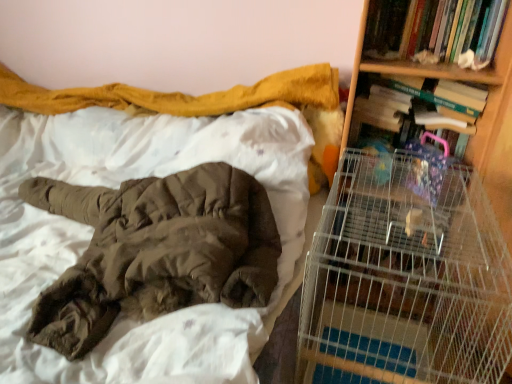
The width and height of the screenshot is (512, 384). Find the location of `hardcover book at upper right, which is the second book in bottom-to-top order`. hardcover book at upper right, which is the second book in bottom-to-top order is located at coordinates tap(433, 28).

How much space does hardcover book at upper right, positioned as the 1th book in bottom-to-top order, occupy vertically?

It is 13.71 inches.

Where is `wooden bookshelf at right`? The image size is (512, 384). wooden bookshelf at right is located at coordinates (442, 77).

In terms of height, does wooden bookshelf at right look taller or shorter compared to hardcover book at upper right, which is the second book in bottom-to-top order?

Clearly, wooden bookshelf at right is taller compared to hardcover book at upper right, which is the second book in bottom-to-top order.

Can you confirm if wooden bookshelf at right is thinner than hardcover book at upper right, which is the second book in bottom-to-top order?

In fact, wooden bookshelf at right might be wider than hardcover book at upper right, which is the second book in bottom-to-top order.

Find the location of `bookshelf on the left of hardcover book at upper right, which is the second book in bottom-to-top order`. bookshelf on the left of hardcover book at upper right, which is the second book in bottom-to-top order is located at coordinates (442, 77).

Which is more to the right, wooden bookshelf at right or hardcover book at upper right, which is the first book in top-to-bottom order?

Positioned to the right is hardcover book at upper right, which is the first book in top-to-bottom order.

Is brown fuzzy blanket at upper left positioned far away from wooden bookshelf at right?

No, there isn't a large distance between brown fuzzy blanket at upper left and wooden bookshelf at right.

Is wooden bookshelf at right at the back of brown fuzzy blanket at upper left?

A: No, brown fuzzy blanket at upper left is not facing the opposite direction of wooden bookshelf at right.

Is brown fuzzy blanket at upper left smaller than wooden bookshelf at right?

Incorrect, brown fuzzy blanket at upper left is not smaller in size than wooden bookshelf at right.

Measure the distance between wooden bookshelf at right and hardcover book at upper right, the 2th book from the top.

They are 4.76 inches apart.

Between point (495, 81) and point (394, 115), which one is positioned in front?

The point (495, 81) is closer to the camera.

Is wooden bookshelf at right bigger than hardcover book at upper right, the 2th book from the top?

Indeed, wooden bookshelf at right has a larger size compared to hardcover book at upper right, the 2th book from the top.

Can you confirm if wooden bookshelf at right is taller than hardcover book at upper right, the 2th book from the top?

Yes.

Is hardcover book at upper right, the 2th book from the top, smaller than wooden bookshelf at right?

Yes, hardcover book at upper right, the 2th book from the top, is smaller than wooden bookshelf at right.

Is point (375, 113) positioned behind point (346, 114)?

No, it is not.

Would you say hardcover book at upper right, positioned as the 1th book in bottom-to-top order, is inside or outside wooden bookshelf at right?

hardcover book at upper right, positioned as the 1th book in bottom-to-top order, is inside wooden bookshelf at right.

From the image's perspective, which is above, hardcover book at upper right, positioned as the 1th book in bottom-to-top order, or wooden bookshelf at right?

wooden bookshelf at right.

Is brown fuzzy blanket at upper left facing away from hardcover book at upper right, which is the second book in bottom-to-top order?

No.

Would you say brown fuzzy blanket at upper left is inside or outside hardcover book at upper right, which is the second book in bottom-to-top order?

brown fuzzy blanket at upper left exists outside the volume of hardcover book at upper right, which is the second book in bottom-to-top order.

From the picture: Who is bigger, brown fuzzy blanket at upper left or hardcover book at upper right, which is the second book in bottom-to-top order?

Bigger between the two is brown fuzzy blanket at upper left.

Is hardcover book at upper right, positioned as the 1th book in bottom-to-top order, aimed at metal wire cage at right?

Yes, hardcover book at upper right, positioned as the 1th book in bottom-to-top order, is oriented towards metal wire cage at right.

Does hardcover book at upper right, the 2th book from the top, appear on the left side of metal wire cage at right?

No.

Looking at this image, considering the relative sizes of hardcover book at upper right, positioned as the 1th book in bottom-to-top order, and metal wire cage at right in the image provided, is hardcover book at upper right, positioned as the 1th book in bottom-to-top order, wider than metal wire cage at right?

No, hardcover book at upper right, positioned as the 1th book in bottom-to-top order, is not wider than metal wire cage at right.

In the scene shown: Does hardcover book at upper right, the 2th book from the top, come behind metal wire cage at right?

Yes.

Who is bigger, wooden bookshelf at right or brown fuzzy blanket at upper left?

Bigger between the two is brown fuzzy blanket at upper left.

Is wooden bookshelf at right to the right of brown fuzzy blanket at upper left from the viewer's perspective?

Yes.

From a real-world perspective, is wooden bookshelf at right physically below brown fuzzy blanket at upper left?

Actually, wooden bookshelf at right is physically above brown fuzzy blanket at upper left in the real world.

Considering the sizes of wooden bookshelf at right and brown fuzzy blanket at upper left in the image, is wooden bookshelf at right wider or thinner than brown fuzzy blanket at upper left?

Clearly, wooden bookshelf at right has less width compared to brown fuzzy blanket at upper left.

What are the coordinates of `bookshelf located on the left of hardcover book at upper right, which is the second book in bottom-to-top order` in the screenshot? It's located at (442, 77).

Where is `bookshelf located above the brown fuzzy blanket at upper left (from the image's perspective)`? The image size is (512, 384). bookshelf located above the brown fuzzy blanket at upper left (from the image's perspective) is located at coordinates (442, 77).

When comparing their distances from brown fuzzy blanket at upper left, does metal wire cage at right or hardcover book at upper right, positioned as the 1th book in bottom-to-top order, seem closer?

metal wire cage at right is positioned closer to the anchor brown fuzzy blanket at upper left.

Looking at the image, which one is located further to hardcover book at upper right, the 2th book from the top, brown fuzzy blanket at upper left or hardcover book at upper right, which is the first book in top-to-bottom order?

brown fuzzy blanket at upper left is further to hardcover book at upper right, the 2th book from the top.

Based on their spatial positions, is hardcover book at upper right, positioned as the 1th book in bottom-to-top order, or hardcover book at upper right, which is the second book in bottom-to-top order, closer to wooden bookshelf at right?

hardcover book at upper right, which is the second book in bottom-to-top order, lies closer to wooden bookshelf at right than the other object.

Considering their positions, is metal wire cage at right positioned closer to hardcover book at upper right, the 2th book from the top, than hardcover book at upper right, which is the second book in bottom-to-top order?

The object closer to hardcover book at upper right, the 2th book from the top, is hardcover book at upper right, which is the second book in bottom-to-top order.

From the image, which object appears to be nearer to hardcover book at upper right, which is the second book in bottom-to-top order, wooden bookshelf at right or hardcover book at upper right, the 2th book from the top?

wooden bookshelf at right.

When comparing their distances from brown fuzzy blanket at upper left, does hardcover book at upper right, the 2th book from the top, or metal wire cage at right seem closer?

metal wire cage at right is positioned closer to the anchor brown fuzzy blanket at upper left.

Considering their positions, is brown fuzzy blanket at upper left positioned further to hardcover book at upper right, which is the second book in bottom-to-top order, than metal wire cage at right?

brown fuzzy blanket at upper left.

Looking at this image, when comparing their distances from metal wire cage at right, does hardcover book at upper right, positioned as the 1th book in bottom-to-top order, or wooden bookshelf at right seem closer?

The object closer to metal wire cage at right is wooden bookshelf at right.

Where is `bookshelf between hardcover book at upper right, which is the second book in bottom-to-top order, and hardcover book at upper right, the 2th book from the top, from top to bottom`? bookshelf between hardcover book at upper right, which is the second book in bottom-to-top order, and hardcover book at upper right, the 2th book from the top, from top to bottom is located at coordinates (442, 77).

Identify the location of bookshelf between brown fuzzy blanket at upper left and hardcover book at upper right, which is the second book in bottom-to-top order, in the horizontal direction. This screenshot has height=384, width=512. (442, 77).

This screenshot has height=384, width=512. I want to click on bookcase situated between brown fuzzy blanket at upper left and hardcover book at upper right, the 2th book from the top, from left to right, so click(415, 256).

Identify the location of bookshelf located between brown fuzzy blanket at upper left and hardcover book at upper right, positioned as the 1th book in bottom-to-top order, in the left-right direction. The width and height of the screenshot is (512, 384). (442, 77).